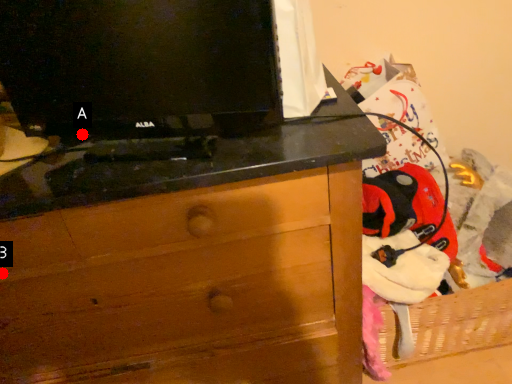
Question: Two points are circled on the image, labeled by A and B beside each circle. Which of the following is the closest to the observer?

Choices:
 (A) A is closer
 (B) B is closer

Answer: (B)